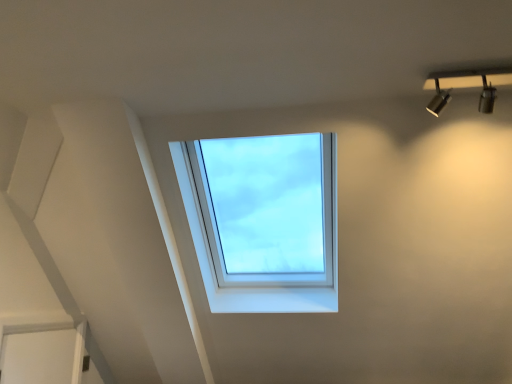
Question: Should I look upward or downward to see metallic silver spotlight at upper right?

Choices:
 (A) up
 (B) down

Answer: (A)